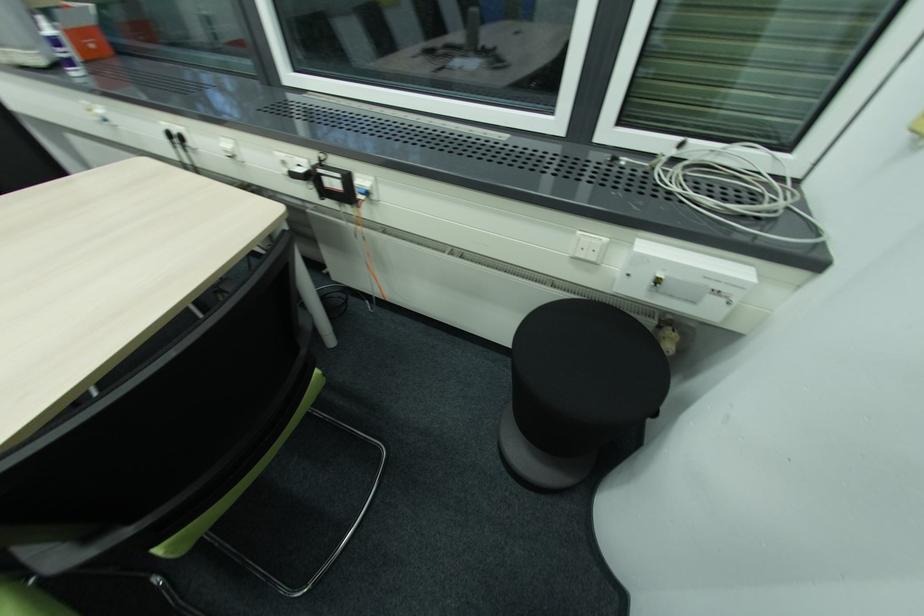
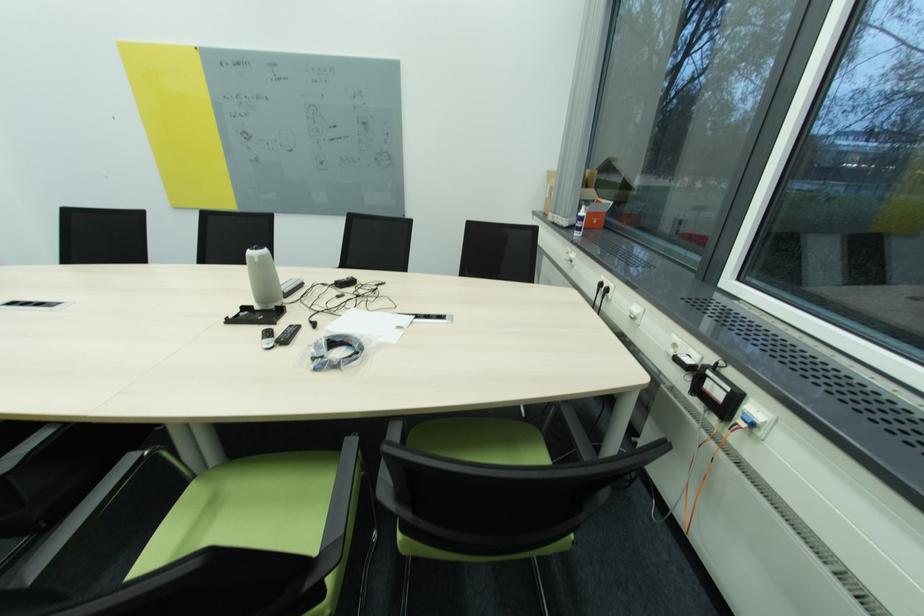
The point at (174,136) is marked in the first image. Where is the corresponding point in the second image?

(604, 286)